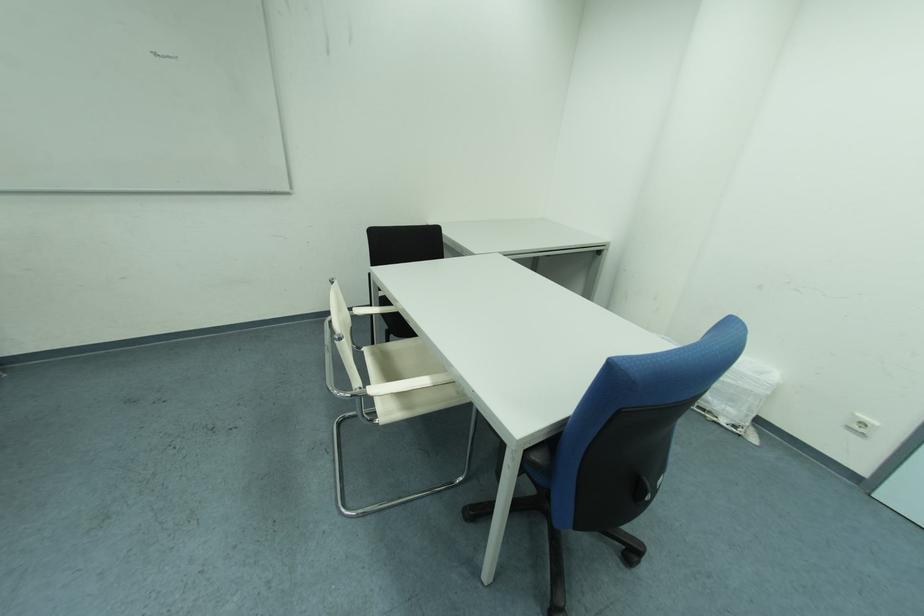
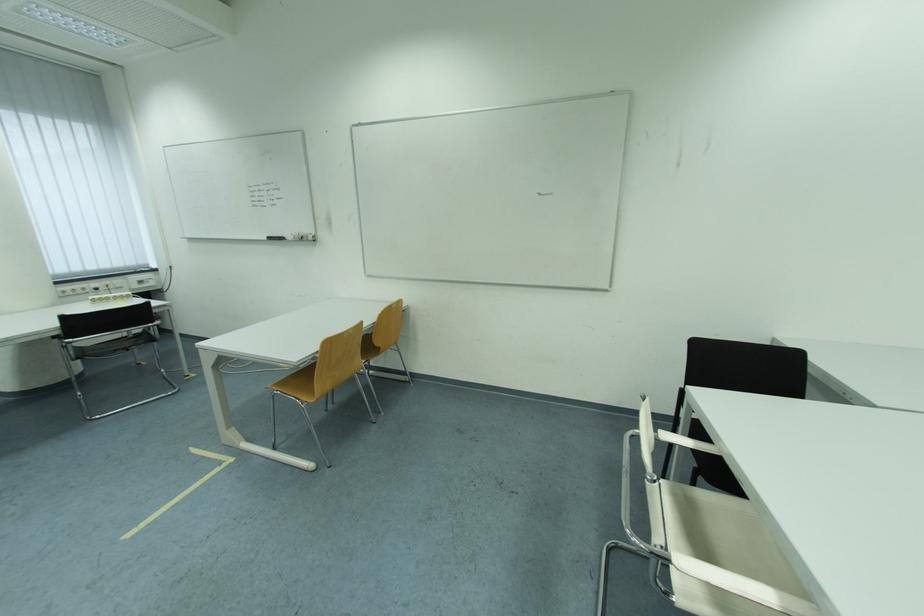
Question: The camera is either moving clockwise (left) or counter-clockwise (right) around the object. The first image is from the beginning of the video and the second image is from the end. Is the camera moving left or right when shooting the video?

Choices:
 (A) Left
 (B) Right

Answer: (B)